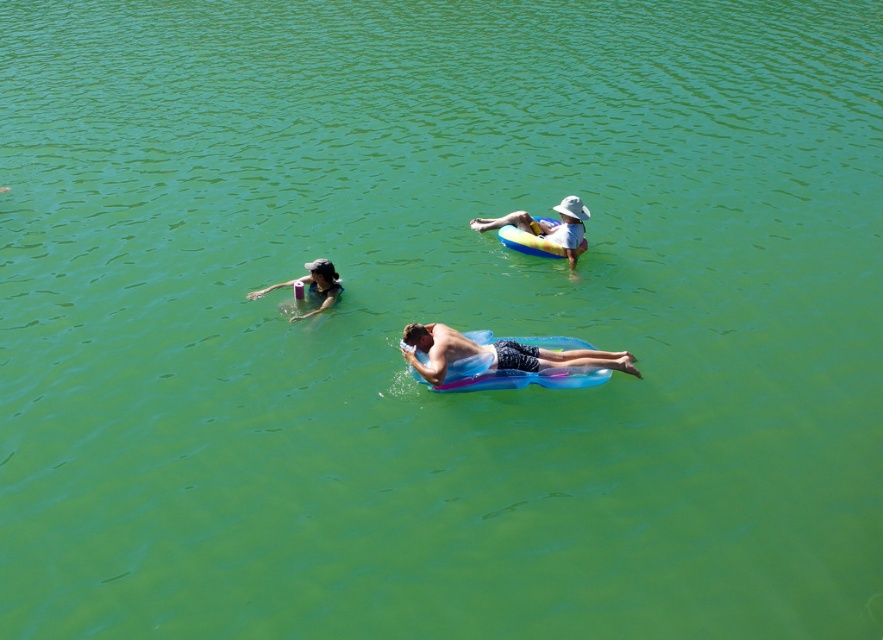
Question: Does translucent blue float at center have a larger size compared to matte black swim cap at upper left?

Choices:
 (A) yes
 (B) no

Answer: (A)

Question: Is translucent blue float at center positioned behind blue rubber ring at upper center?

Choices:
 (A) yes
 (B) no

Answer: (B)

Question: Estimate the real-world distances between objects in this image. Which object is closer to the translucent blue float at center?

Choices:
 (A) blue rubber ring at upper center
 (B) matte black swim cap at upper left

Answer: (B)

Question: Is blue rubber ring at upper center further to camera compared to matte black swim cap at upper left?

Choices:
 (A) no
 (B) yes

Answer: (B)

Question: Which of these objects is positioned farthest from the translucent blue float at center?

Choices:
 (A) matte black swim cap at upper left
 (B) blue rubber ring at upper center

Answer: (B)

Question: Which object is closer to the camera taking this photo?

Choices:
 (A) matte black swim cap at upper left
 (B) translucent blue float at center
 (C) blue rubber ring at upper center

Answer: (B)